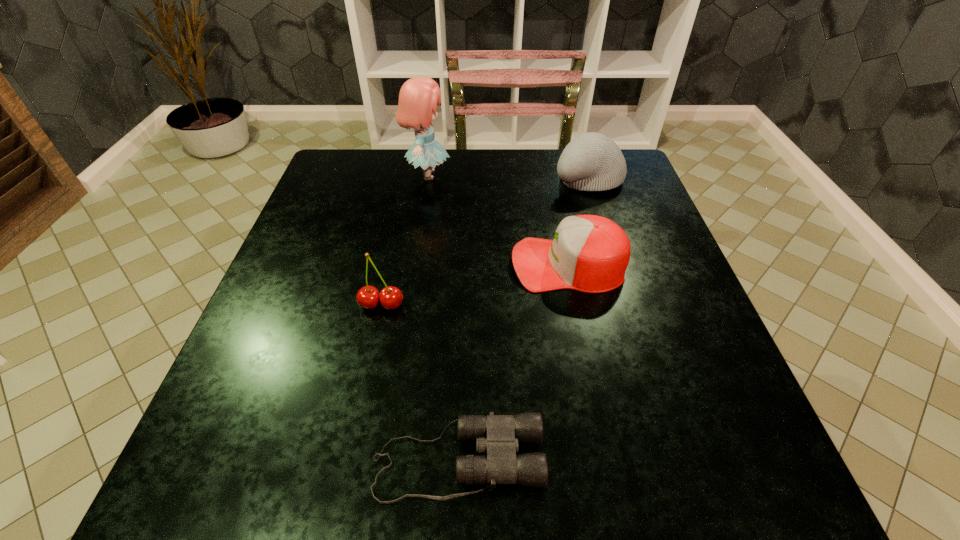
At what (x,y) coordinates should I click in order to perform the action: click on unoccupied position between the beanie and the cherry. Please return your answer as a coordinate pair (x, y). The width and height of the screenshot is (960, 540). Looking at the image, I should click on (485, 241).

The width and height of the screenshot is (960, 540). What are the coordinates of `vacant space that is in between the beanie and the binoculars` in the screenshot? It's located at (523, 319).

Identify the location of free area in between the doll and the binoculars. The image size is (960, 540). (x=443, y=318).

The height and width of the screenshot is (540, 960). What are the coordinates of `vacant point located between the binoculars and the tallest object` in the screenshot? It's located at pyautogui.click(x=443, y=318).

I want to click on object that is the fourth closest to the beanie, so click(x=498, y=435).

The height and width of the screenshot is (540, 960). Identify the location of object that stands as the fourth closest to the binoculars. (592, 161).

This screenshot has height=540, width=960. I want to click on free space that satisfies the following two spatial constraints: 1. on the front-facing side of the baseball cap; 2. with the stems of the cherry pointing upwards, so click(x=576, y=305).

This screenshot has width=960, height=540. In order to click on vacant space that satisfies the following two spatial constraints: 1. on the front-facing side of the third nearest object; 2. with the stems of the cherry pointing upwards in this screenshot , I will do `click(576, 305)`.

Where is `free location that satisfies the following two spatial constraints: 1. on the front-facing side of the doll; 2. on the left side of the beanie`? free location that satisfies the following two spatial constraints: 1. on the front-facing side of the doll; 2. on the left side of the beanie is located at coordinates (427, 178).

This screenshot has height=540, width=960. What are the coordinates of `free location that satisfies the following two spatial constraints: 1. on the front-facing side of the baseball cap; 2. with the stems of the second nearest object pointing upwards` in the screenshot? It's located at (576, 305).